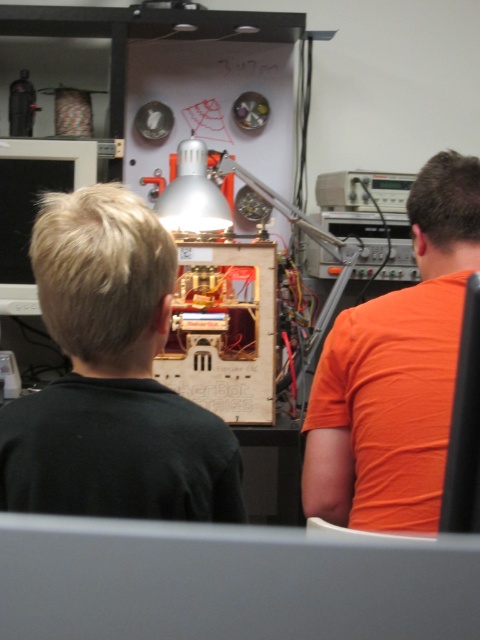
You are standing in the workshop and want to place a small tool between the two points, point (x=107, y=195) and point (x=330, y=477). Which point should you place the tool closer to so that it appears larger in the camera view?

Place the tool closer to point (x=107, y=195) because it is closer to the camera, making objects placed there appear larger in the camera view.

What are the coordinates of the black matte boy at center in the image?

The black matte boy at center is located at coordinates point (111, 378).